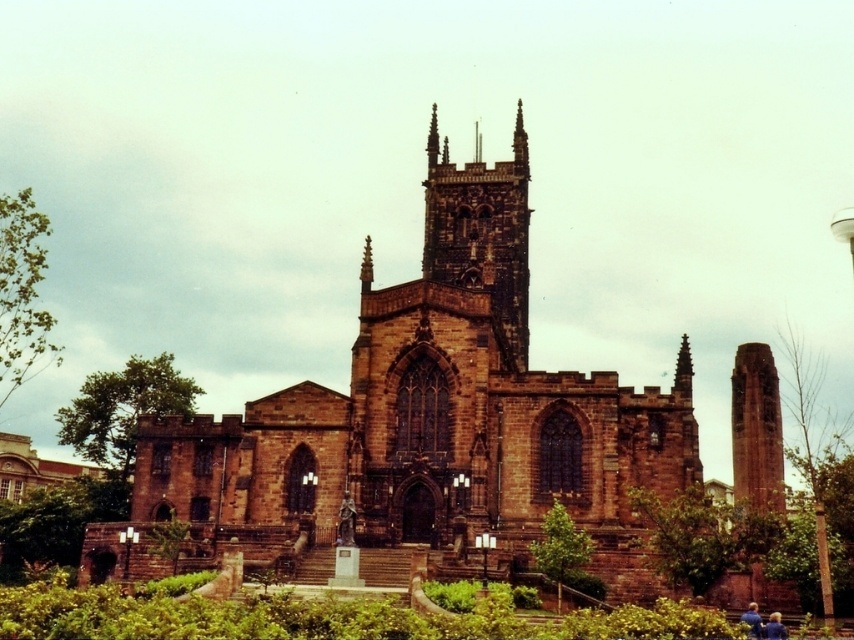
From the picture: You are a tour guide leading a group to the historic site. The group wants to take a photo that includes both the brown stone church at center and the red brick tower at center. The camera you have can capture a maximum distance of 25 meters between the closest and farthest objects in the frame. Can you position the group so that both structures are within the camera range?

The distance between the brown stone church at center and the red brick tower at center is 26.97 meters, which exceeds the camera range of 25 meters. Therefore, it is not possible to capture both structures within the camera range.